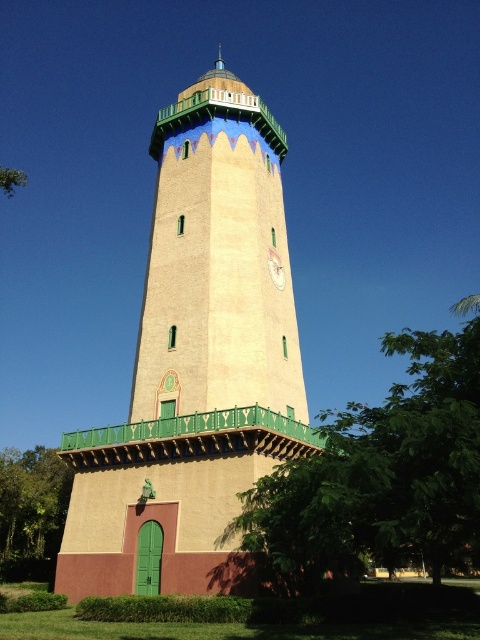
Question: Which point is farther from the camera taking this photo?

Choices:
 (A) (192, 248)
 (B) (37, 579)
 (C) (267, 260)

Answer: (B)

Question: Is beige stucco bell tower at center above green leafy tree at lower left?

Choices:
 (A) no
 (B) yes

Answer: (B)

Question: Can you confirm if green leafy tree at center is positioned below green leafy tree at lower left?

Choices:
 (A) yes
 (B) no

Answer: (B)

Question: Is the position of beige stucco bell tower at center less distant than that of green leafy tree at center?

Choices:
 (A) no
 (B) yes

Answer: (A)

Question: Which is nearer to the beige stucco bell tower at center?

Choices:
 (A) matte gold clock at center
 (B) green leafy tree at center

Answer: (A)

Question: Among these objects, which one is farthest from the camera?

Choices:
 (A) matte gold clock at center
 (B) beige stucco bell tower at center

Answer: (A)